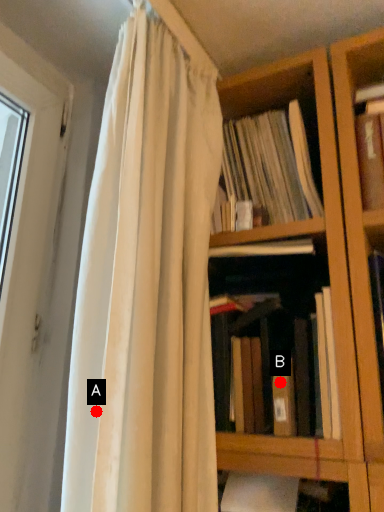
Question: Two points are circled on the image, labeled by A and B beside each circle. Which point appears closest to the camera in this image?

Choices:
 (A) A is closer
 (B) B is closer

Answer: (A)